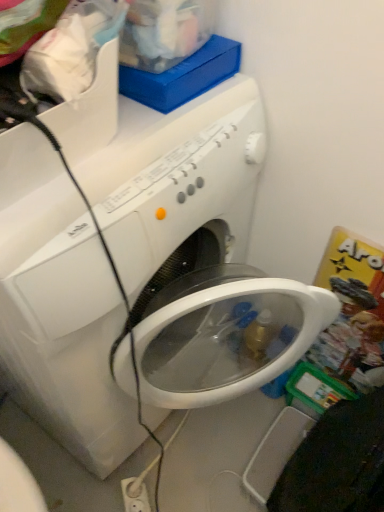
Question: Does white plastic electric outlet at lower center have a lesser height compared to white glossy washing machine at center?

Choices:
 (A) no
 (B) yes

Answer: (B)

Question: Does white plastic electric outlet at lower center have a greater height compared to white glossy washing machine at center?

Choices:
 (A) no
 (B) yes

Answer: (A)

Question: Is white glossy washing machine at center a part of white plastic electric outlet at lower center?

Choices:
 (A) yes
 (B) no

Answer: (B)

Question: Is white plastic electric outlet at lower center bigger than white glossy washing machine at center?

Choices:
 (A) yes
 (B) no

Answer: (B)

Question: Is white plastic electric outlet at lower center looking in the opposite direction of white glossy washing machine at center?

Choices:
 (A) no
 (B) yes

Answer: (A)

Question: Can you confirm if white plastic electric outlet at lower center is thinner than white glossy washing machine at center?

Choices:
 (A) yes
 (B) no

Answer: (A)

Question: Is white glossy washing machine at center smaller than white plastic electric outlet at lower center?

Choices:
 (A) yes
 (B) no

Answer: (B)

Question: Does white glossy washing machine at center have a larger size compared to white plastic electric outlet at lower center?

Choices:
 (A) no
 (B) yes

Answer: (B)

Question: Considering the relative sizes of white glossy washing machine at center and white plastic electric outlet at lower center in the image provided, is white glossy washing machine at center thinner than white plastic electric outlet at lower center?

Choices:
 (A) no
 (B) yes

Answer: (A)

Question: Considering the relative positions of white glossy washing machine at center and white plastic electric outlet at lower center in the image provided, is white glossy washing machine at center to the left of white plastic electric outlet at lower center from the viewer's perspective?

Choices:
 (A) yes
 (B) no

Answer: (A)

Question: Does white glossy washing machine at center have a lesser height compared to white plastic electric outlet at lower center?

Choices:
 (A) yes
 (B) no

Answer: (B)

Question: Is white glossy washing machine at center facing away from white plastic electric outlet at lower center?

Choices:
 (A) no
 (B) yes

Answer: (A)

Question: Considering the positions of white plastic electric outlet at lower center and white glossy washing machine at center in the image, is white plastic electric outlet at lower center bigger or smaller than white glossy washing machine at center?

Choices:
 (A) big
 (B) small

Answer: (B)